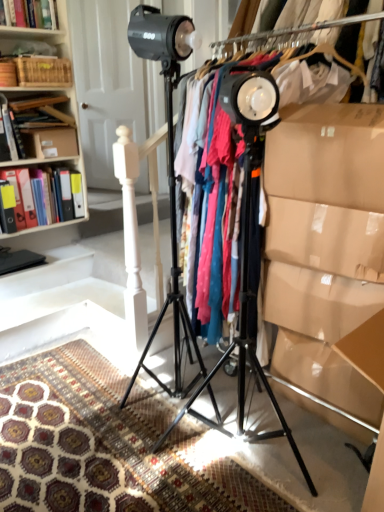
In order to face wooden crate at upper left, should I rotate leftwards or rightwards?

Turn left by 19.426 degrees to look at wooden crate at upper left.

What do you see at coordinates (244, 332) in the screenshot?
I see `black matte tripod at center, placed as the first tripod when sorted from right to left` at bounding box center [244, 332].

Where is `brown cardboard box at upper left`? This screenshot has height=512, width=384. brown cardboard box at upper left is located at coordinates (50, 142).

Describe the element at coordinates (30, 13) in the screenshot. I see `hardcover book at upper left, the 1th book when ordered from top to bottom` at that location.

The image size is (384, 512). Describe the element at coordinates (18, 260) in the screenshot. I see `black matte book at lower left, the third book from the top` at that location.

In the scene shown: Measure the distance between matte plastic folders at left, which is the 2th book from bottom to top, and camera.

matte plastic folders at left, which is the 2th book from bottom to top, is 2.52 meters away from camera.

This screenshot has width=384, height=512. I want to click on wooden crate at upper left, so click(x=37, y=67).

From a real-world perspective, is matte plastic folders at left, which is the 2th book from bottom to top, above or below brown cardboard box at upper left?

matte plastic folders at left, which is the 2th book from bottom to top, is below brown cardboard box at upper left.

From the image's perspective, is matte plastic folders at left, positioned as the second book in top-to-bottom order, under brown cardboard box at upper left?

Indeed, from the image's perspective, matte plastic folders at left, positioned as the second book in top-to-bottom order, is shown beneath brown cardboard box at upper left.

Which is behind, point (48, 187) or point (58, 141)?

The point (48, 187) is farther from the camera.

Which is more to the left, matte plastic folders at left, which is the 2th book from bottom to top, or brown cardboard box at upper left?

matte plastic folders at left, which is the 2th book from bottom to top, is more to the left.

Does point (245, 158) come closer to viewer compared to point (177, 351)?

Yes, it is.

Which object is more forward, black matte tripod at center, the 2th tripod when ordered from left to right, or black matte tripod at center, which is the first tripod from left to right?

black matte tripod at center, the 2th tripod when ordered from left to right, is in front.

Locate an element on the screen. The image size is (384, 512). tripod behind the black matte tripod at center, the 2th tripod when ordered from left to right is located at coordinates (172, 274).

Is black matte tripod at center, the 2th tripod when ordered from left to right, positioned beyond the bounds of black matte tripod at center, which is the first tripod from left to right?

Indeed, black matte tripod at center, the 2th tripod when ordered from left to right, is completely outside black matte tripod at center, which is the first tripod from left to right.

Is patterned carpet at center touching black matte tripod at center, which is the first tripod from left to right?

No, patterned carpet at center is not making contact with black matte tripod at center, which is the first tripod from left to right.

Does point (105, 412) appear closer or farther from the camera than point (171, 211)?

Point (105, 412).

From the image's perspective, which one is positioned lower, patterned carpet at center or black matte tripod at center, which is the first tripod from left to right?

patterned carpet at center, from the image's perspective.

Considering their positions, is hardcover book at upper left, positioned as the 3th book in bottom-to-top order, located in front of or behind black matte book at lower left, the third book from the top?

Visually, hardcover book at upper left, positioned as the 3th book in bottom-to-top order, is located in front of black matte book at lower left, the third book from the top.

You are a GUI agent. You are given a task and a screenshot of the screen. Output one action in this format:
    pyautogui.click(x=<x>, y=<y>)
    Task: Click on the book that is the 2nd object above the black matte book at lower left, the third book from the top (from a real-world perspective)
    Image resolution: width=384 pixels, height=512 pixels.
    Given the screenshot: What is the action you would take?
    pyautogui.click(x=30, y=13)

Does hardcover book at upper left, the 1th book when ordered from top to bottom, appear on the right side of black matte book at lower left, which is the first book from bottom to top?

Correct, you'll find hardcover book at upper left, the 1th book when ordered from top to bottom, to the right of black matte book at lower left, which is the first book from bottom to top.

Considering the sizes of objects brown cardboard box at upper left and patterned carpet at center in the image provided, who is taller, brown cardboard box at upper left or patterned carpet at center?

With more height is brown cardboard box at upper left.

Is brown cardboard box at upper left looking in the opposite direction of patterned carpet at center?

brown cardboard box at upper left is not turned away from patterned carpet at center.

Is point (65, 142) more distant than point (141, 388)?

Yes, it is.

Is brown cardboard box at upper left not close to patterned carpet at center?

Indeed, brown cardboard box at upper left is not near patterned carpet at center.

Is the depth of black matte tripod at center, which appears as the second tripod when viewed from the right, greater than that of matte plastic folders at left, which is the 2th book from bottom to top?

No, black matte tripod at center, which appears as the second tripod when viewed from the right, is closer to the viewer.

Would you say black matte tripod at center, which appears as the second tripod when viewed from the right, is outside matte plastic folders at left, positioned as the second book in top-to-bottom order?

black matte tripod at center, which appears as the second tripod when viewed from the right, lies outside matte plastic folders at left, positioned as the second book in top-to-bottom order,'s area.

Where is `the 3rd book behind the black matte tripod at center, which appears as the second tripod when viewed from the right, starting your count from the anchor`? the 3rd book behind the black matte tripod at center, which appears as the second tripod when viewed from the right, starting your count from the anchor is located at coordinates (16, 166).

From the image's perspective, is black matte tripod at center, which appears as the second tripod when viewed from the right, located above or below matte plastic folders at left, which is the 2th book from bottom to top?

black matte tripod at center, which appears as the second tripod when viewed from the right, is situated lower than matte plastic folders at left, which is the 2th book from bottom to top, in the image.

Based on the photo, is matte plastic folders at left, positioned as the second book in top-to-bottom order, aimed at black matte tripod at center, placed as the first tripod when sorted from right to left?

Yes, matte plastic folders at left, positioned as the second book in top-to-bottom order, faces towards black matte tripod at center, placed as the first tripod when sorted from right to left.

Considering the positions of objects matte plastic folders at left, which is the 2th book from bottom to top, and black matte tripod at center, placed as the first tripod when sorted from right to left, in the image provided, who is behind, matte plastic folders at left, which is the 2th book from bottom to top, or black matte tripod at center, placed as the first tripod when sorted from right to left,?

matte plastic folders at left, which is the 2th book from bottom to top.

Could black matte tripod at center, the 2th tripod when ordered from left to right, be considered to be inside matte plastic folders at left, positioned as the second book in top-to-bottom order?

No.

From their relative heights in the image, would you say matte plastic folders at left, positioned as the second book in top-to-bottom order, is taller or shorter than black matte tripod at center, the 2th tripod when ordered from left to right?

In the image, matte plastic folders at left, positioned as the second book in top-to-bottom order, appears to be shorter than black matte tripod at center, the 2th tripod when ordered from left to right.

Which book is the 1st one when counting from the front of the brown cardboard box at upper left? Please provide its 2D coordinates.

[(16, 166)]

This screenshot has height=512, width=384. Identify the location of tripod below the black matte tripod at center, which is the first tripod from left to right (from a real-world perspective). (244, 332).

Looking at the image, which one is located closer to black matte tripod at center, which appears as the second tripod when viewed from the right, brown cardboard box at upper left or black matte book at lower left, which is the first book from bottom to top?

brown cardboard box at upper left.

Considering their positions, is black matte book at lower left, which is the first book from bottom to top, positioned further to brown cardboard box at upper left than matte plastic folders at left, positioned as the second book in top-to-bottom order?

Among the two, black matte book at lower left, which is the first book from bottom to top, is located further to brown cardboard box at upper left.

Considering their positions, is black matte tripod at center, placed as the first tripod when sorted from right to left, positioned closer to hardcover book at upper left, the 1th book when ordered from top to bottom, than patterned carpet at center?

Among the two, black matte tripod at center, placed as the first tripod when sorted from right to left, is located nearer to hardcover book at upper left, the 1th book when ordered from top to bottom.

From the image, which object appears to be farther from black matte tripod at center, which appears as the second tripod when viewed from the right, brown cardboard box at upper left or matte plastic folders at left, positioned as the second book in top-to-bottom order?

matte plastic folders at left, positioned as the second book in top-to-bottom order.

When comparing their distances from black matte book at lower left, the third book from the top, does wooden crate at upper left or patterned carpet at center seem further?

patterned carpet at center.

Based on their spatial positions, is hardcover book at upper left, positioned as the 3th book in bottom-to-top order, or black matte tripod at center, which appears as the second tripod when viewed from the right, closer to brown cardboard box at upper left?

hardcover book at upper left, positioned as the 3th book in bottom-to-top order.

When comparing their distances from black matte tripod at center, which is the first tripod from left to right, does patterned carpet at center or black matte book at lower left, which is the first book from bottom to top, seem further?

black matte book at lower left, which is the first book from bottom to top, is positioned further to the anchor black matte tripod at center, which is the first tripod from left to right.

Considering their positions, is black matte book at lower left, the third book from the top, positioned further to hardcover book at upper left, positioned as the 3th book in bottom-to-top order, than brown cardboard box at upper left?

black matte book at lower left, the third book from the top, lies further to hardcover book at upper left, positioned as the 3th book in bottom-to-top order, than the other object.

Where is `shelf between black matte tripod at center, which is the first tripod from left to right, and black matte book at lower left, which is the first book from bottom to top, in the front-back direction`? shelf between black matte tripod at center, which is the first tripod from left to right, and black matte book at lower left, which is the first book from bottom to top, in the front-back direction is located at coordinates (37, 67).

Where is `tripod between hardcover book at upper left, positioned as the 3th book in bottom-to-top order, and black matte tripod at center, the 2th tripod when ordered from left to right, in the vertical direction`? The width and height of the screenshot is (384, 512). tripod between hardcover book at upper left, positioned as the 3th book in bottom-to-top order, and black matte tripod at center, the 2th tripod when ordered from left to right, in the vertical direction is located at coordinates (172, 274).

Find the location of a particular element. cardboard box between wooden crate at upper left and black matte book at lower left, which is the first book from bottom to top, in the vertical direction is located at coordinates (50, 142).

Identify the location of cardboard box between wooden crate at upper left and patterned carpet at center in the vertical direction. (50, 142).